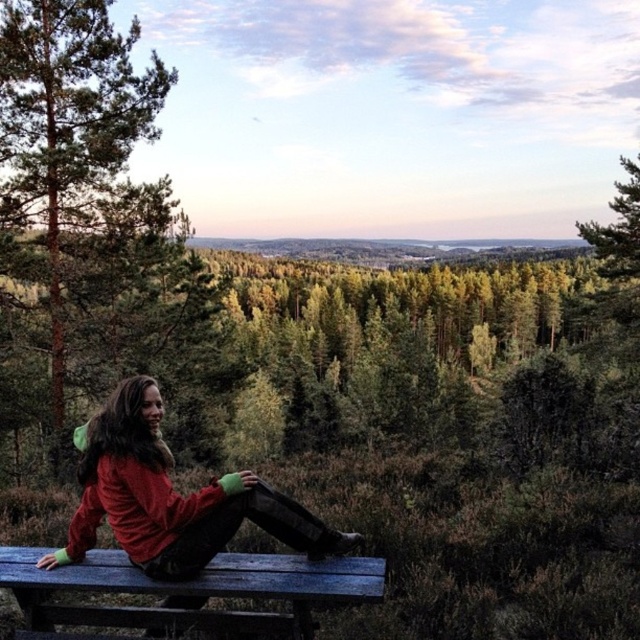
Question: Which object appears farthest from the camera in this image?

Choices:
 (A) brown wood tree at left
 (B) green leafy tree at upper right
 (C) red fleece jacket at lower left
 (D) blue painted wood bench at lower center

Answer: (B)

Question: Which is nearer to the green leafy tree at upper right?

Choices:
 (A) brown wood tree at left
 (B) blue painted wood bench at lower center

Answer: (A)

Question: Observing the image, what is the correct spatial positioning of red fleece jacket at lower left in reference to green leafy tree at upper right?

Choices:
 (A) below
 (B) above

Answer: (A)

Question: Which object is farther from the camera taking this photo?

Choices:
 (A) brown wood tree at left
 (B) green leafy tree at upper right

Answer: (B)

Question: Does brown wood tree at left have a larger size compared to red fleece jacket at lower left?

Choices:
 (A) yes
 (B) no

Answer: (A)

Question: From the image, what is the correct spatial relationship of brown wood tree at left in relation to red fleece jacket at lower left?

Choices:
 (A) below
 (B) above

Answer: (B)